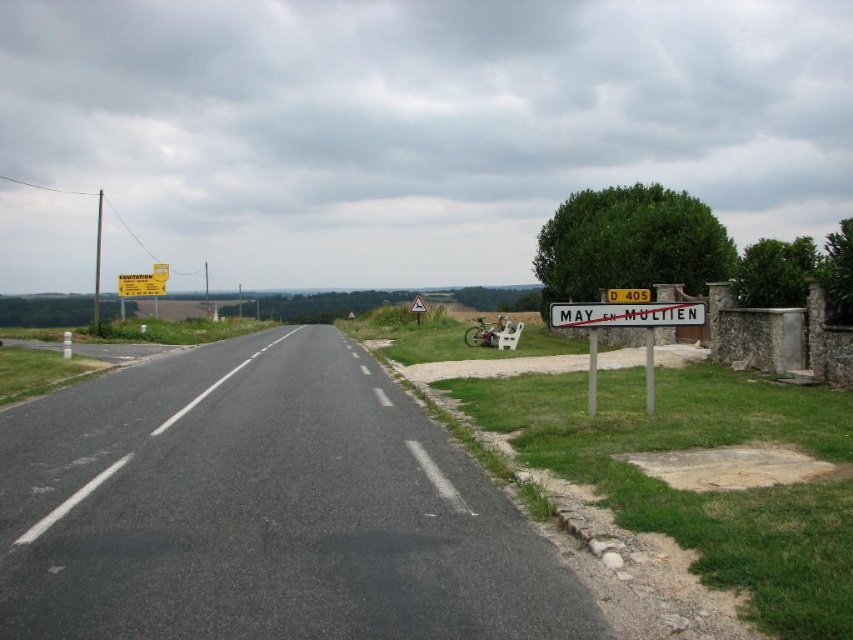
Question: Is black asphalt road at center closer to camera compared to white plastic street sign at right?

Choices:
 (A) no
 (B) yes

Answer: (B)

Question: Is black asphalt road at center to the left of white plastic street sign at right from the viewer's perspective?

Choices:
 (A) no
 (B) yes

Answer: (B)

Question: Estimate the real-world distances between objects in this image. Which object is closer to the black asphalt road at center?

Choices:
 (A) white plastic street sign at right
 (B) white plastic sign at right

Answer: (B)

Question: Which point appears closest to the camera in this image?

Choices:
 (A) (689, 305)
 (B) (112, 595)

Answer: (B)

Question: Among these objects, which one is nearest to the camera?

Choices:
 (A) white plastic street sign at right
 (B) white plastic sign at right

Answer: (B)

Question: Can you confirm if white plastic sign at right is thinner than white plastic street sign at right?

Choices:
 (A) no
 (B) yes

Answer: (A)